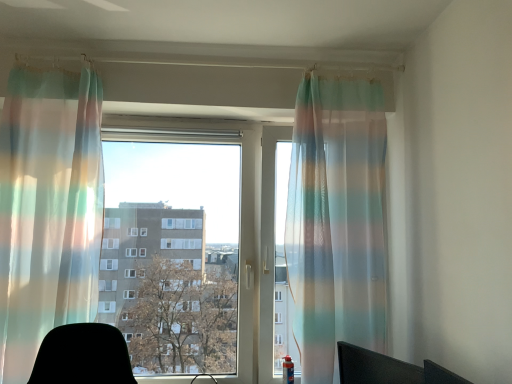
Question: Does translucent rainbow striped curtain at left, which is the 1th curtain from left to right, have a lesser height compared to black matte computer chair at lower right?

Choices:
 (A) no
 (B) yes

Answer: (A)

Question: Is translucent rainbow striped curtain at left, which is the 1th curtain from left to right, directly adjacent to black matte computer chair at lower right?

Choices:
 (A) yes
 (B) no

Answer: (B)

Question: Is translucent rainbow striped curtain at left, the 2th curtain viewed from the right, wider than black matte computer chair at lower right?

Choices:
 (A) no
 (B) yes

Answer: (B)

Question: Does translucent rainbow striped curtain at left, the 2th curtain viewed from the right, have a lesser width compared to black matte computer chair at lower right?

Choices:
 (A) no
 (B) yes

Answer: (A)

Question: Is translucent rainbow striped curtain at left, the 2th curtain viewed from the right, positioned beyond the bounds of black matte computer chair at lower right?

Choices:
 (A) yes
 (B) no

Answer: (A)

Question: From a real-world perspective, is translucent rainbow striped curtain at left, which is the 1th curtain from left to right, physically located above or below black matte computer chair at lower right?

Choices:
 (A) below
 (B) above

Answer: (B)

Question: Considering the positions of translucent rainbow striped curtain at left, which is the 1th curtain from left to right, and black matte computer chair at lower right in the image, is translucent rainbow striped curtain at left, which is the 1th curtain from left to right, wider or thinner than black matte computer chair at lower right?

Choices:
 (A) thin
 (B) wide

Answer: (B)

Question: Relative to black matte computer chair at lower right, is translucent rainbow striped curtain at left, which is the 1th curtain from left to right, in front or behind?

Choices:
 (A) front
 (B) behind

Answer: (B)

Question: Considering the positions of translucent rainbow striped curtain at left, the 2th curtain viewed from the right, and black matte computer chair at lower right in the image, is translucent rainbow striped curtain at left, the 2th curtain viewed from the right, taller or shorter than black matte computer chair at lower right?

Choices:
 (A) short
 (B) tall

Answer: (B)

Question: From a real-world perspective, is translucent striped curtain at center, which appears as the 1th curtain when viewed from the right, positioned above or below translucent rainbow striped curtain at left, which is the 1th curtain from left to right?

Choices:
 (A) below
 (B) above

Answer: (A)

Question: Is translucent striped curtain at center, which appears as the 1th curtain when viewed from the right, wider or thinner than translucent rainbow striped curtain at left, which is the 1th curtain from left to right?

Choices:
 (A) wide
 (B) thin

Answer: (B)

Question: From the image's perspective, is translucent striped curtain at center, positioned as the second curtain in left-to-right order, positioned above or below translucent rainbow striped curtain at left, which is the 1th curtain from left to right?

Choices:
 (A) below
 (B) above

Answer: (A)

Question: Based on their sizes in the image, would you say translucent striped curtain at center, which appears as the 1th curtain when viewed from the right, is bigger or smaller than translucent rainbow striped curtain at left, which is the 1th curtain from left to right?

Choices:
 (A) small
 (B) big

Answer: (B)

Question: Does point (53, 100) appear closer or farther from the camera than point (142, 135)?

Choices:
 (A) closer
 (B) farther

Answer: (A)

Question: From the image's perspective, is translucent rainbow striped curtain at left, the 2th curtain viewed from the right, above or below transparent fabric at center?

Choices:
 (A) above
 (B) below

Answer: (A)